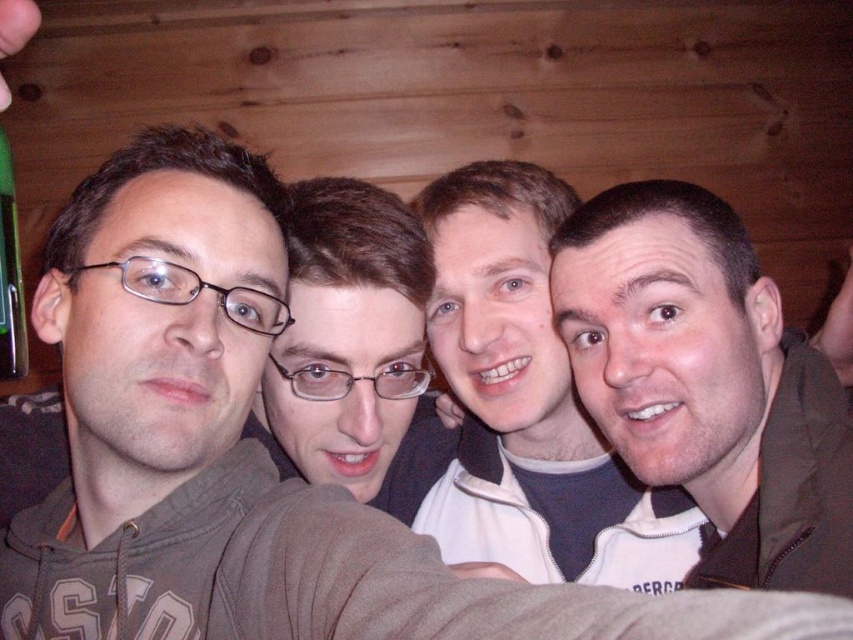
Who is positioned more to the right, brown matte jacket at right or white fleece jacket at center?

brown matte jacket at right

This screenshot has height=640, width=853. What are the coordinates of `brown matte jacket at right` in the screenshot? It's located at (706, 381).

Which is above, brown matte jacket at right or matte black glasses at center?

matte black glasses at center

Who is more forward, (648, 323) or (363, 481)?

Point (648, 323) is in front.

Locate an element on the screen. This screenshot has height=640, width=853. brown matte jacket at right is located at coordinates (706, 381).

Looking at this image, between white fleece jacket at center and green plastic bottle at left, which one has less height?

With less height is green plastic bottle at left.

Where is `white fleece jacket at center`? The height and width of the screenshot is (640, 853). white fleece jacket at center is located at coordinates (529, 403).